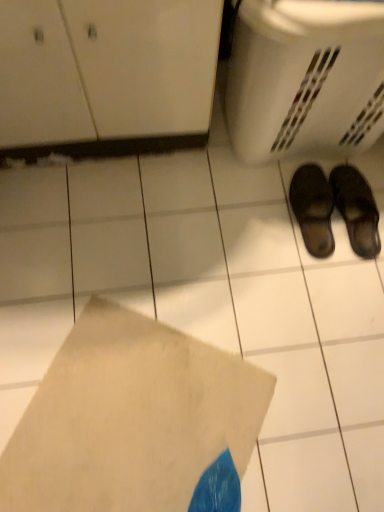
How much space does leather slipper at lower right, the second footwear when ordered from left to right, occupy horizontally?

28.16 centimeters.

What do you see at coordinates (333, 209) in the screenshot?
I see `leather slipper at lower right, the second footwear when ordered from left to right` at bounding box center [333, 209].

What do you see at coordinates (313, 209) in the screenshot? I see `black leather slippers at lower right, which ranks as the second footwear in right-to-left order` at bounding box center [313, 209].

What is the approximate width of white plastic basket at lower right?

white plastic basket at lower right is 38.57 centimeters in width.

The width and height of the screenshot is (384, 512). Identify the location of white matte envelope at lower center. (130, 418).

Which of these two, white plastic basket at lower right or leather slipper at lower right, the second footwear when ordered from left to right, is smaller?

Smaller between the two is leather slipper at lower right, the second footwear when ordered from left to right.

From the image's perspective, would you say white plastic basket at lower right is shown under leather slipper at lower right, the second footwear when ordered from left to right?

No.

Can leather slipper at lower right, arranged as the first footwear when viewed from the right, be found inside white plastic basket at lower right?

No, white plastic basket at lower right does not contain leather slipper at lower right, arranged as the first footwear when viewed from the right.

Is black leather slippers at lower right, which is the 1th footwear from left to right, positioned with its back to white matte envelope at lower center?

black leather slippers at lower right, which is the 1th footwear from left to right, does not have its back to white matte envelope at lower center.

Between black leather slippers at lower right, which is the 1th footwear from left to right, and white matte envelope at lower center, which one is positioned in front?

white matte envelope at lower center is more forward.

Is black leather slippers at lower right, which is the 1th footwear from left to right, to the left of white matte envelope at lower center from the viewer's perspective?

No, black leather slippers at lower right, which is the 1th footwear from left to right, is not to the left of white matte envelope at lower center.

From the image's perspective, is black leather slippers at lower right, which ranks as the second footwear in right-to-left order, over white matte envelope at lower center?

Indeed, from the image's perspective, black leather slippers at lower right, which ranks as the second footwear in right-to-left order, is shown above white matte envelope at lower center.

Is white plastic basket at lower right aimed at white matte envelope at lower center?

No, white plastic basket at lower right is not turned towards white matte envelope at lower center.

From their relative heights in the image, would you say white plastic basket at lower right is taller or shorter than white matte envelope at lower center?

white plastic basket at lower right is taller than white matte envelope at lower center.

What's the angular difference between white plastic basket at lower right and white matte envelope at lower center's facing directions?

They differ by 58.1 degrees in their facing directions.

Does white plastic basket at lower right have a smaller size compared to white matte envelope at lower center?

Incorrect, white plastic basket at lower right is not smaller in size than white matte envelope at lower center.

Considering the relative sizes of white matte envelope at lower center and black leather slippers at lower right, which ranks as the second footwear in right-to-left order, in the image provided, is white matte envelope at lower center bigger than black leather slippers at lower right, which ranks as the second footwear in right-to-left order,?

Yes, white matte envelope at lower center is bigger than black leather slippers at lower right, which ranks as the second footwear in right-to-left order.

Is white matte envelope at lower center behind black leather slippers at lower right, which is the 1th footwear from left to right?

No, white matte envelope at lower center is in front of black leather slippers at lower right, which is the 1th footwear from left to right.

Identify the location of the 1st footwear to the right when counting from the white matte envelope at lower center. (313, 209).

From the image's perspective, relative to black leather slippers at lower right, which ranks as the second footwear in right-to-left order, is white matte envelope at lower center above or below?

Clearly, from the image's perspective, white matte envelope at lower center is below black leather slippers at lower right, which ranks as the second footwear in right-to-left order.

Does point (329, 251) lie behind point (343, 31)?

Yes, it is.

How many degrees apart are the facing directions of leather slipper at lower right, arranged as the first footwear when viewed from the right, and white plastic basket at lower right?

The angle between the facing direction of leather slipper at lower right, arranged as the first footwear when viewed from the right, and the facing direction of white plastic basket at lower right is 179 degrees.

Between leather slipper at lower right, the second footwear when ordered from left to right, and white plastic basket at lower right, which one has larger width?

With larger width is white plastic basket at lower right.

Is leather slipper at lower right, the second footwear when ordered from left to right, facing towards white plastic basket at lower right?

Yes, leather slipper at lower right, the second footwear when ordered from left to right, is aimed at white plastic basket at lower right.

Is the surface of white matte envelope at lower center in direct contact with leather slipper at lower right, the second footwear when ordered from left to right?

white matte envelope at lower center is not next to leather slipper at lower right, the second footwear when ordered from left to right, and they're not touching.

Which object is further away from the camera, white matte envelope at lower center or leather slipper at lower right, the second footwear when ordered from left to right?

Positioned behind is leather slipper at lower right, the second footwear when ordered from left to right.

Is white matte envelope at lower center positioned beyond the bounds of leather slipper at lower right, arranged as the first footwear when viewed from the right?

Indeed, white matte envelope at lower center is completely outside leather slipper at lower right, arranged as the first footwear when viewed from the right.

Is white matte envelope at lower center wider than leather slipper at lower right, the second footwear when ordered from left to right?

Indeed, white matte envelope at lower center has a greater width compared to leather slipper at lower right, the second footwear when ordered from left to right.

Is leather slipper at lower right, arranged as the first footwear when viewed from the right, oriented away from white matte envelope at lower center?

A: No, leather slipper at lower right, arranged as the first footwear when viewed from the right, is not facing away from white matte envelope at lower center.

Where is `footwear that is the 1st object located above the white matte envelope at lower center (from the image's perspective)`? footwear that is the 1st object located above the white matte envelope at lower center (from the image's perspective) is located at coordinates (333, 209).

From the image's perspective, between leather slipper at lower right, the second footwear when ordered from left to right, and white matte envelope at lower center, which one is located above?

leather slipper at lower right, the second footwear when ordered from left to right, from the image's perspective.

Is leather slipper at lower right, the second footwear when ordered from left to right, situated inside white matte envelope at lower center or outside?

leather slipper at lower right, the second footwear when ordered from left to right, is not enclosed by white matte envelope at lower center.

Identify the location of basket above the leather slipper at lower right, arranged as the first footwear when viewed from the right (from a real-world perspective). This screenshot has width=384, height=512. (305, 77).

Find the location of `envelope that appears below the black leather slippers at lower right, which is the 1th footwear from left to right (from a real-world perspective)`. envelope that appears below the black leather slippers at lower right, which is the 1th footwear from left to right (from a real-world perspective) is located at coordinates (130, 418).

Looking at the image, which one is located closer to white plastic basket at lower right, leather slipper at lower right, arranged as the first footwear when viewed from the right, or black leather slippers at lower right, which is the 1th footwear from left to right?

leather slipper at lower right, arranged as the first footwear when viewed from the right, is positioned closer to the anchor white plastic basket at lower right.

From the image, which object appears to be farther from leather slipper at lower right, the second footwear when ordered from left to right, black leather slippers at lower right, which ranks as the second footwear in right-to-left order, or white matte envelope at lower center?

Among the two, white matte envelope at lower center is located further to leather slipper at lower right, the second footwear when ordered from left to right.

Considering their positions, is white plastic basket at lower right positioned further to white matte envelope at lower center than black leather slippers at lower right, which is the 1th footwear from left to right?

white plastic basket at lower right.

Estimate the real-world distances between objects in this image. Which object is closer to leather slipper at lower right, the second footwear when ordered from left to right, white plastic basket at lower right or white matte envelope at lower center?

Among the two, white plastic basket at lower right is located nearer to leather slipper at lower right, the second footwear when ordered from left to right.

Estimate the real-world distances between objects in this image. Which object is further from leather slipper at lower right, arranged as the first footwear when viewed from the right, white matte envelope at lower center or black leather slippers at lower right, which ranks as the second footwear in right-to-left order?

white matte envelope at lower center is further to leather slipper at lower right, arranged as the first footwear when viewed from the right.

When comparing their distances from black leather slippers at lower right, which ranks as the second footwear in right-to-left order, does white matte envelope at lower center or white plastic basket at lower right seem closer?

The object closer to black leather slippers at lower right, which ranks as the second footwear in right-to-left order, is white plastic basket at lower right.

When comparing their distances from white matte envelope at lower center, does black leather slippers at lower right, which is the 1th footwear from left to right, or leather slipper at lower right, the second footwear when ordered from left to right, seem further?

Based on the image, black leather slippers at lower right, which is the 1th footwear from left to right, appears to be further to white matte envelope at lower center.

When comparing their distances from white plastic basket at lower right, does leather slipper at lower right, the second footwear when ordered from left to right, or white matte envelope at lower center seem further?

white matte envelope at lower center lies further to white plastic basket at lower right than the other object.

The image size is (384, 512). Identify the location of footwear between black leather slippers at lower right, which ranks as the second footwear in right-to-left order, and white matte envelope at lower center in the up-down direction. (333, 209).

Identify the location of footwear between white plastic basket at lower right and leather slipper at lower right, arranged as the first footwear when viewed from the right, along the z-axis. (313, 209).